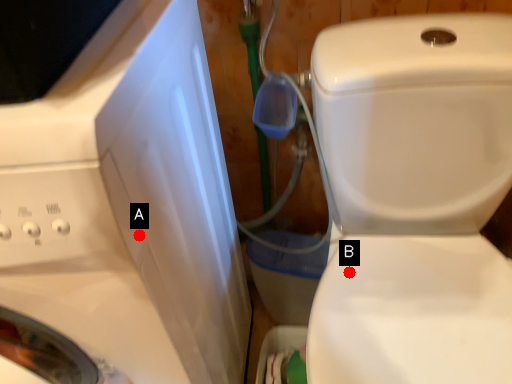
Question: Two points are circled on the image, labeled by A and B beside each circle. Which point is farther from the camera taking this photo?

Choices:
 (A) A is further
 (B) B is further

Answer: (B)